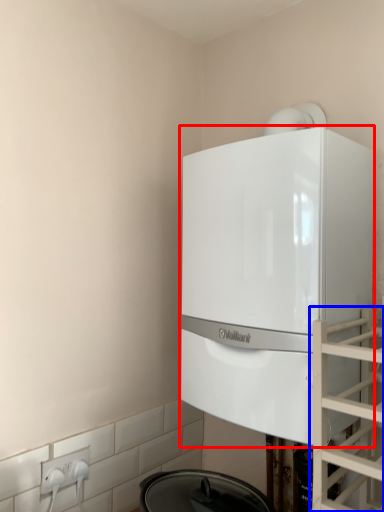
Question: Which of the following is the closest to the observer, home appliance (highlighted by a red box) or glass door (highlighted by a blue box)?

Choices:
 (A) home appliance
 (B) glass door

Answer: (B)